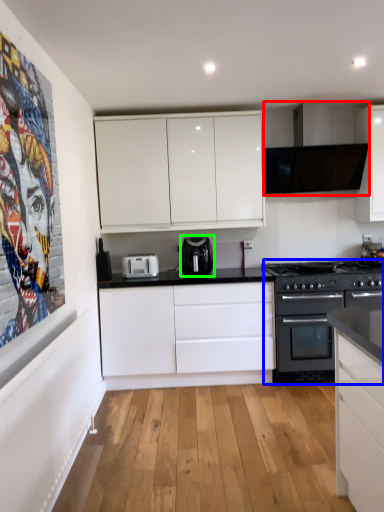
Question: Which object is positioned farthest from exhaust hood (highlighted by a red box)? Select from appliance (highlighted by a blue box) and kitchen appliance (highlighted by a green box).

Choices:
 (A) appliance
 (B) kitchen appliance

Answer: (B)